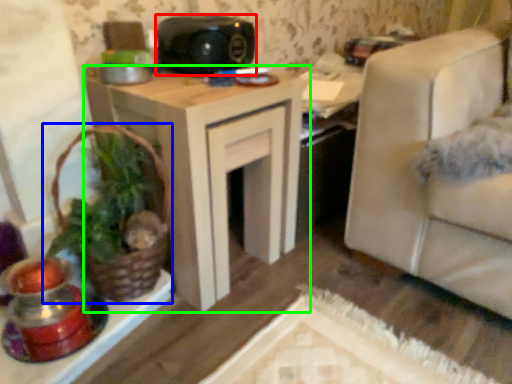
Question: Which object is the farthest from speaker (highlighted by a red box)? Choose among these: houseplant (highlighted by a blue box) or table (highlighted by a green box).

Choices:
 (A) houseplant
 (B) table

Answer: (A)